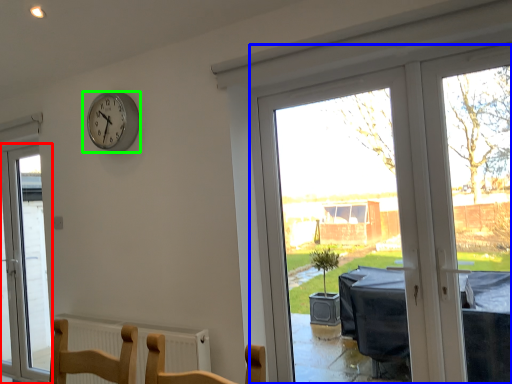
Question: Which object is positioned farthest from window (highlighted by a red box)? Select from window (highlighted by a blue box) and wall clock (highlighted by a green box).

Choices:
 (A) window
 (B) wall clock

Answer: (A)